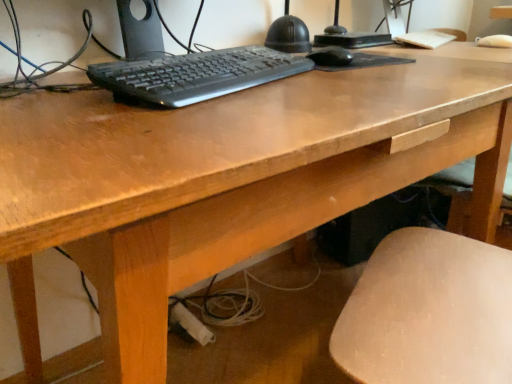
Question: Considering the relative positions of black plastic keyboard at center and black matte mouse at center in the image provided, is black plastic keyboard at center to the left of black matte mouse at center from the viewer's perspective?

Choices:
 (A) yes
 (B) no

Answer: (A)

Question: From a real-world perspective, is black plastic keyboard at center located higher than black matte mouse at center?

Choices:
 (A) no
 (B) yes

Answer: (B)

Question: Can you confirm if black plastic keyboard at center is positioned to the right of black matte mouse at center?

Choices:
 (A) no
 (B) yes

Answer: (A)

Question: Is black plastic keyboard at center thinner than black matte mouse at center?

Choices:
 (A) yes
 (B) no

Answer: (B)

Question: Is black plastic keyboard at center in front of black matte mouse at center?

Choices:
 (A) no
 (B) yes

Answer: (B)

Question: Can we say black plastic keyboard at center lies outside black matte mouse at center?

Choices:
 (A) yes
 (B) no

Answer: (A)

Question: Is black matte mouse at center taller than black plastic keyboard at center?

Choices:
 (A) yes
 (B) no

Answer: (B)

Question: Is black matte mouse at center next to black plastic keyboard at center and touching it?

Choices:
 (A) yes
 (B) no

Answer: (B)

Question: Considering the relative positions of black matte mouse at center and black plastic keyboard at center in the image provided, is black matte mouse at center in front of black plastic keyboard at center?

Choices:
 (A) no
 (B) yes

Answer: (A)

Question: Is black matte mouse at center aimed at black plastic keyboard at center?

Choices:
 (A) yes
 (B) no

Answer: (B)

Question: Is black matte mouse at center smaller than black plastic keyboard at center?

Choices:
 (A) no
 (B) yes

Answer: (B)

Question: Can you confirm if black matte mouse at center is shorter than black plastic keyboard at center?

Choices:
 (A) no
 (B) yes

Answer: (B)

Question: From their relative heights in the image, would you say black plastic keyboard at center is taller or shorter than black matte mouse at center?

Choices:
 (A) tall
 (B) short

Answer: (A)